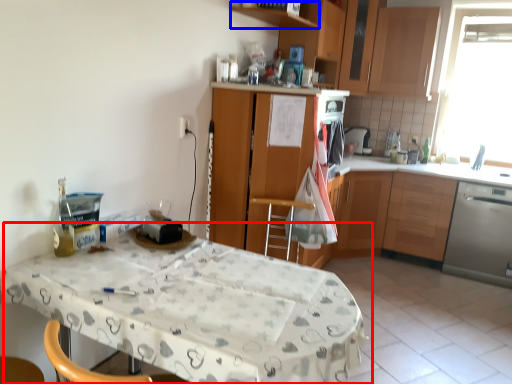
Question: Which object appears farthest to the camera in this image, table (highlighted by a red box) or shelf (highlighted by a blue box)?

Choices:
 (A) table
 (B) shelf

Answer: (B)